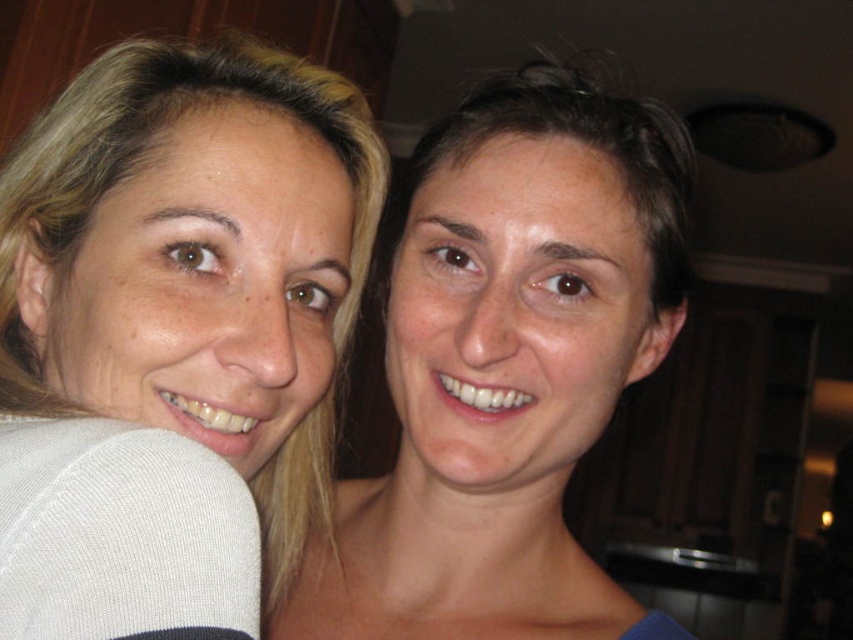
Based on the scene description, can you determine the spatial relationship between the blonde hair at left and the smooth skin face at center? Is the blonde hair above or below the face?

The blonde hair at left is below the smooth skin face at center, so the hair is positioned lower than the face.